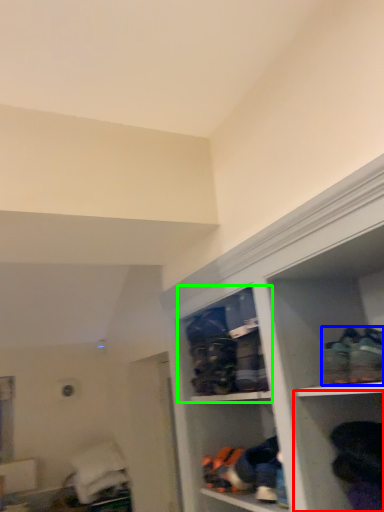
Question: Which object is positioned farthest from shelf (highlighted by a red box)? Select from footwear (highlighted by a blue box) and cabinet (highlighted by a green box).

Choices:
 (A) footwear
 (B) cabinet

Answer: (B)